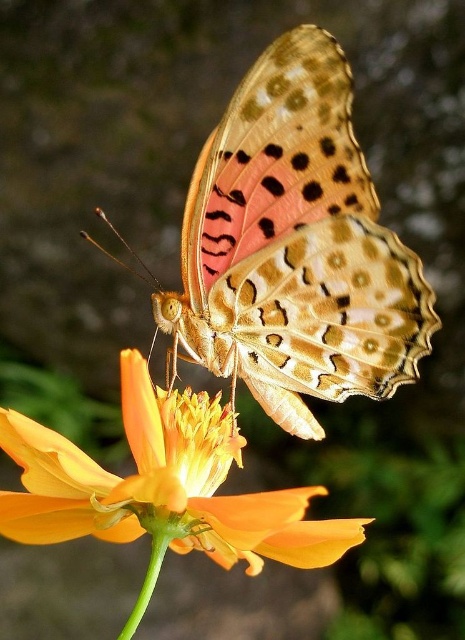
You are a photographer trying to capture the orange matte flower at center without the spotted orange butterfly at center blocking it. What should you do?

The orange matte flower at center is behind the spotted orange butterfly at center, so you should move the butterfly or adjust your angle to capture the flower without obstruction.